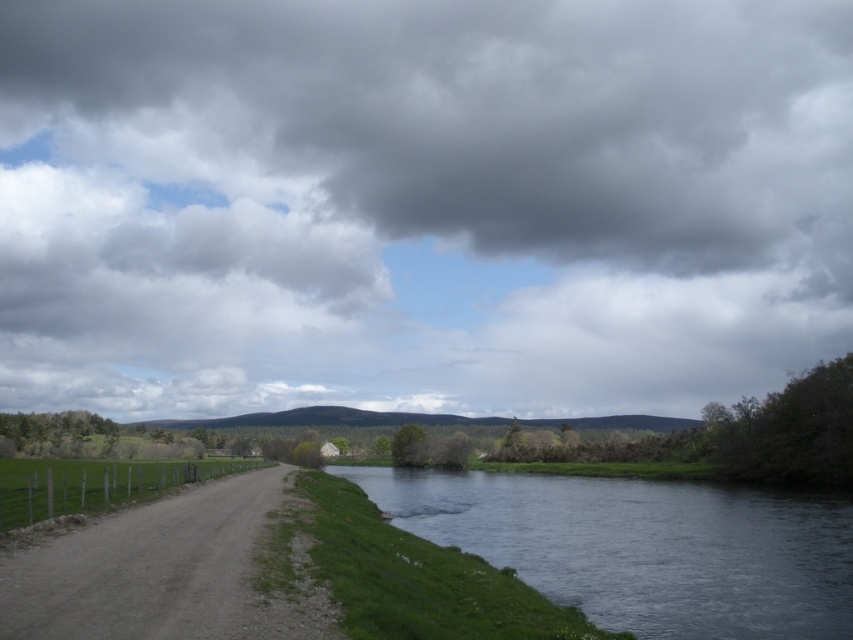
Can you confirm if dark gray water at lower center is shorter than dirt/gravel road at left?

No.

Does dark gray water at lower center appear over dirt/gravel road at left?

Incorrect, dark gray water at lower center is not positioned above dirt/gravel road at left.

Which is behind, point (804, 636) or point (144, 628)?

The point (804, 636) is behind.

The height and width of the screenshot is (640, 853). I want to click on dark gray water at lower center, so click(643, 547).

Is cloudy sky at upper center closer to the viewer compared to dark gray water at lower center?

No.

Does cloudy sky at upper center appear over dark gray water at lower center?

Correct, cloudy sky at upper center is located above dark gray water at lower center.

Identify the location of cloudy sky at upper center. (421, 204).

The height and width of the screenshot is (640, 853). I want to click on cloudy sky at upper center, so click(421, 204).

Who is taller, cloudy sky at upper center or dirt/gravel road at left?

cloudy sky at upper center

Can you confirm if cloudy sky at upper center is bigger than dirt/gravel road at left?

Indeed, cloudy sky at upper center has a larger size compared to dirt/gravel road at left.

Image resolution: width=853 pixels, height=640 pixels. What do you see at coordinates (421, 204) in the screenshot? I see `cloudy sky at upper center` at bounding box center [421, 204].

This screenshot has width=853, height=640. What are the coordinates of `cloudy sky at upper center` in the screenshot? It's located at (421, 204).